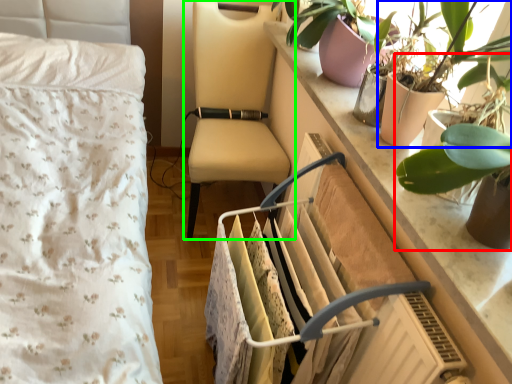
Question: Which is farther away from houseplant (highlighted by a red box)? houseplant (highlighted by a blue box) or chair (highlighted by a green box)?

Choices:
 (A) houseplant
 (B) chair

Answer: (B)